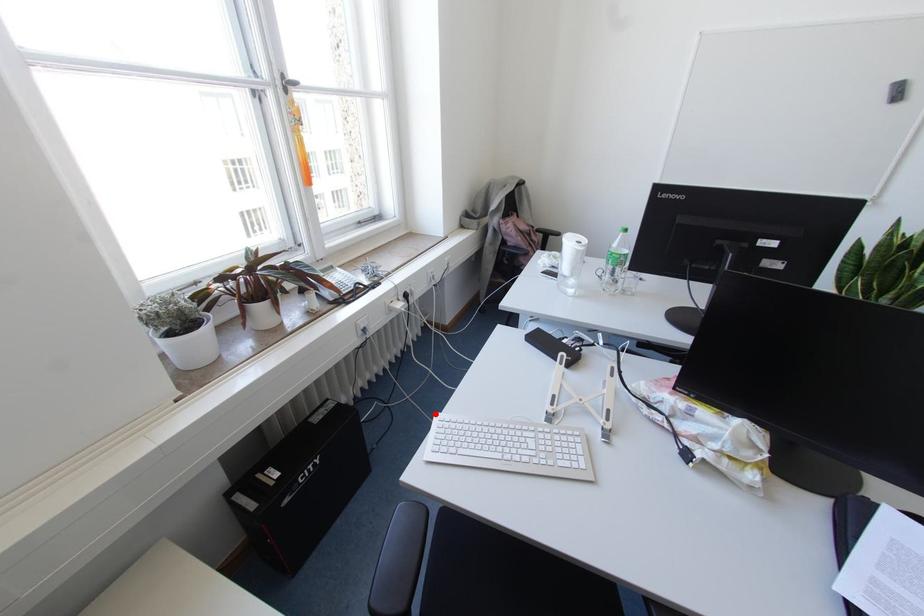
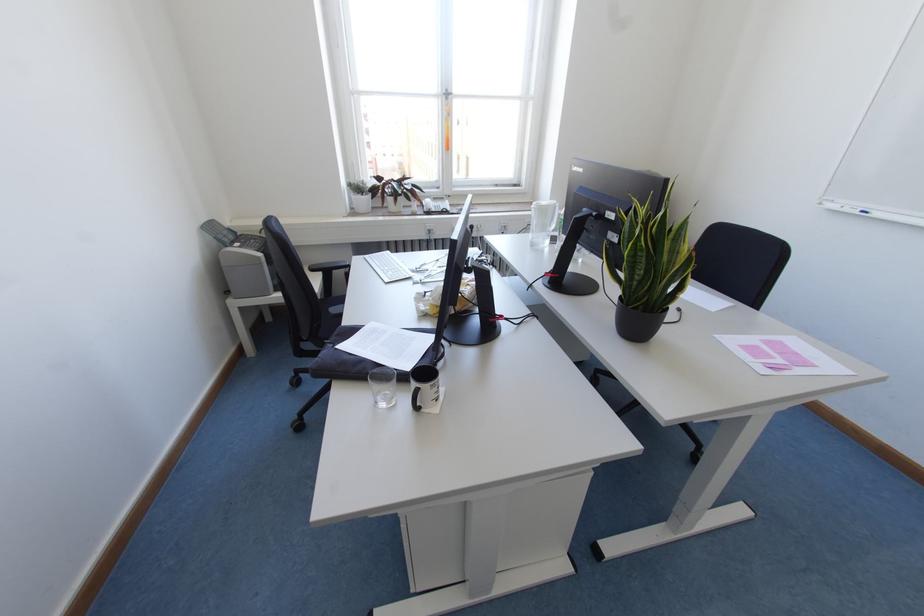
Question: I am providing you with two images of the same scene from different viewpoints. Given a red point in image1, look at the same physical point in image2. Is it:

Choices:
 (A) Closer to the viewpoint
 (B) Farther from the viewpoint

Answer: (B)